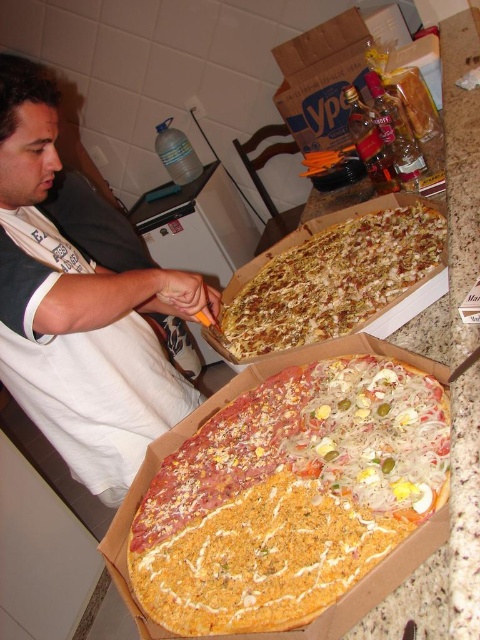
You are a delivery person who just arrived at the address and see the cheesy crust pizza at center and the white cotton shirt at left. Which item is closer to the left side of the counter?

The white cotton shirt at left is closer to the left side of the counter because the cheesy crust pizza at center is positioned on the right side of it.